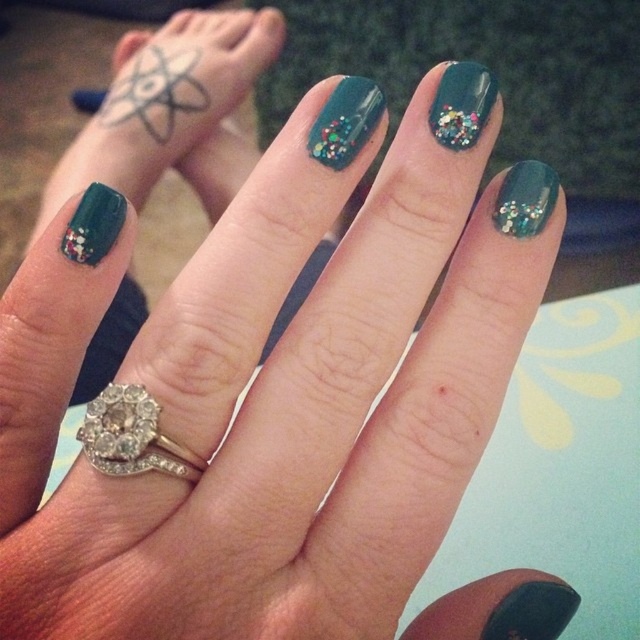
Does black ink atom at upper left have a lesser width compared to glittery teal nail at upper right?

Incorrect, black ink atom at upper left's width is not less than glittery teal nail at upper right's.

Can you confirm if black ink atom at upper left is taller than glittery teal nail at upper right?

Correct, black ink atom at upper left is much taller as glittery teal nail at upper right.

Measure the distance between point (147, 60) and camera.

Point (147, 60) and camera are 1.16 meters apart from each other.

Locate an element on the screen. The width and height of the screenshot is (640, 640). black ink atom at upper left is located at coordinates [156, 90].

Who is more forward, (461, 86) or (493, 205)?

Point (461, 86) is in front.

The image size is (640, 640). Describe the element at coordinates (461, 104) in the screenshot. I see `teal glitter nail polish at upper right` at that location.

Where is `teal glitter nail polish at upper right`? This screenshot has height=640, width=640. teal glitter nail polish at upper right is located at coordinates (461, 104).

Is diamondmetallicring at center further to camera compared to teal glitter nail polish at center?

No, diamondmetallicring at center is in front of teal glitter nail polish at center.

Who is more forward, (129, 413) or (340, 104)?

Point (129, 413) is more forward.

Is point (161, 452) behind point (378, 116)?

No, it is not.

Locate an element on the screen. This screenshot has width=640, height=640. diamondmetallicring at center is located at coordinates (131, 435).